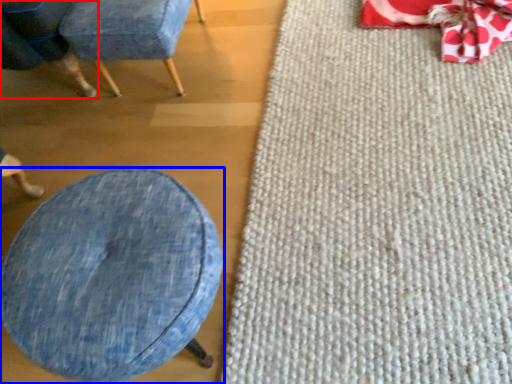
Question: Which object appears closest to the camera in this image, chair (highlighted by a red box) or furniture (highlighted by a blue box)?

Choices:
 (A) chair
 (B) furniture

Answer: (B)